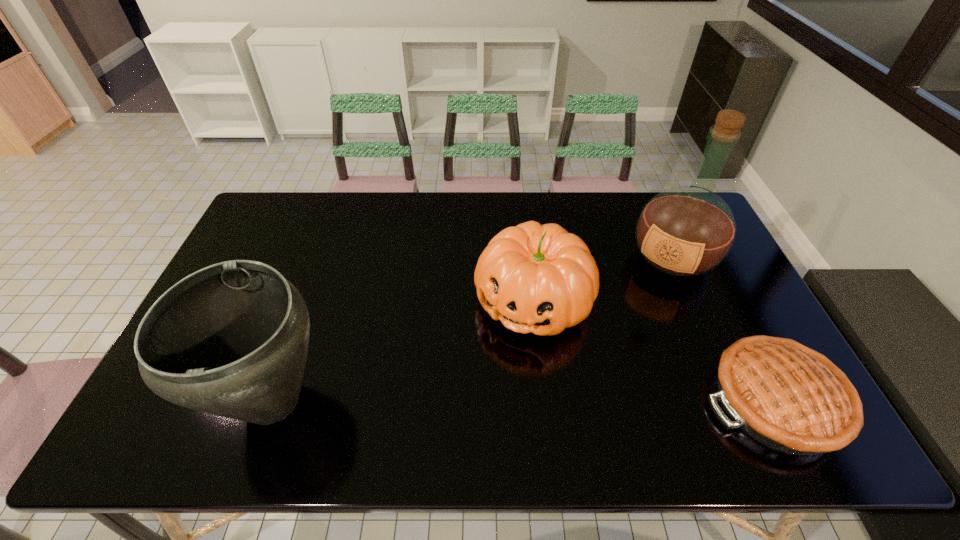
Locate an element on the screen. object that is at the near left corner is located at coordinates (231, 339).

The width and height of the screenshot is (960, 540). Find the location of `object located at the far right corner`. object located at the far right corner is located at coordinates (685, 231).

The image size is (960, 540). I want to click on object that is at the near right corner, so click(791, 398).

In order to click on vacant space at the far edge of the desktop in this screenshot , I will do `click(375, 207)`.

Locate an element on the screen. Image resolution: width=960 pixels, height=540 pixels. free space at the near edge of the desktop is located at coordinates point(477,377).

The image size is (960, 540). What are the coordinates of `free space at the right edge of the desktop` in the screenshot? It's located at (701, 306).

This screenshot has width=960, height=540. I want to click on vacant space at the far left corner, so click(x=313, y=192).

At what (x,y) coordinates should I click in order to perform the action: click on unoccupied position between the tallest object and the pie. Please return your answer as a coordinate pair (x, y). Looking at the image, I should click on (724, 329).

Locate an element on the screen. The height and width of the screenshot is (540, 960). free space between the pie and the second object from left to right is located at coordinates (655, 351).

Identify the location of free space that is in between the pumpkin and the second tallest object. (403, 350).